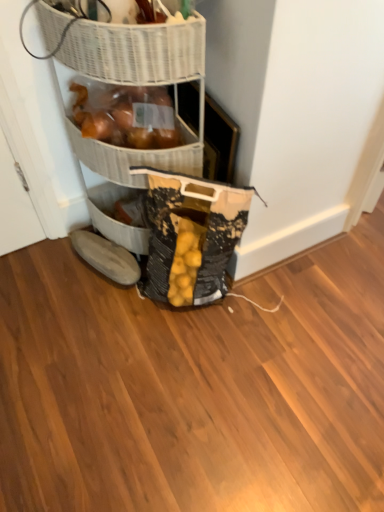
The width and height of the screenshot is (384, 512). What are the coordinates of `free space in front of textured canvas bag at lower center` in the screenshot? It's located at (186, 358).